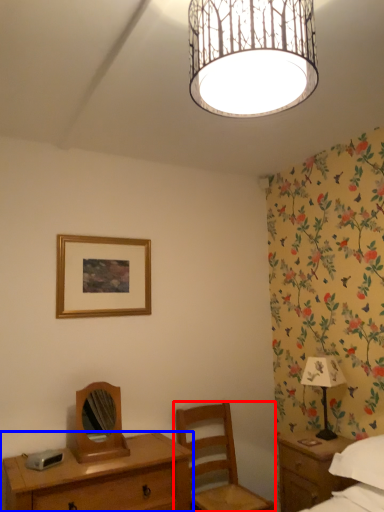
Question: Which object appears farthest to the camera in this image, chair (highlighted by a red box) or desk (highlighted by a blue box)?

Choices:
 (A) chair
 (B) desk

Answer: (A)